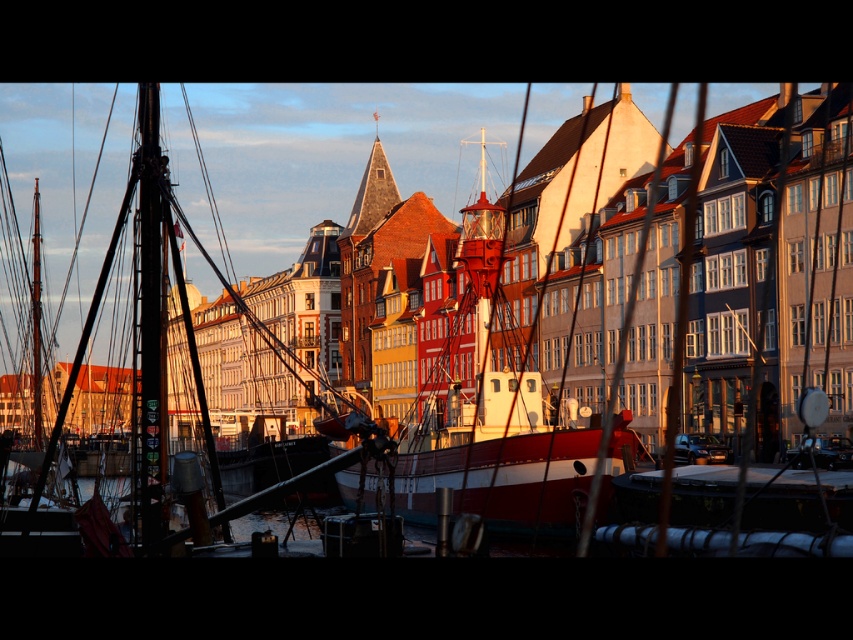
Question: Can you confirm if red matte/lightweight boat at center is positioned below wooden ship at left?

Choices:
 (A) yes
 (B) no

Answer: (B)

Question: Which point is closer to the camera?

Choices:
 (A) red matte/lightweight boat at center
 (B) wooden ship at left

Answer: (B)

Question: Does red matte/lightweight boat at center appear on the left side of wooden ship at left?

Choices:
 (A) no
 (B) yes

Answer: (A)

Question: Is red matte/lightweight boat at center above wooden ship at left?

Choices:
 (A) yes
 (B) no

Answer: (A)

Question: Which of the following is the farthest from the observer?

Choices:
 (A) wooden ship at left
 (B) red matte/lightweight boat at center

Answer: (B)

Question: Which object appears closest to the camera in this image?

Choices:
 (A) wooden ship at left
 (B) red matte/lightweight boat at center

Answer: (A)